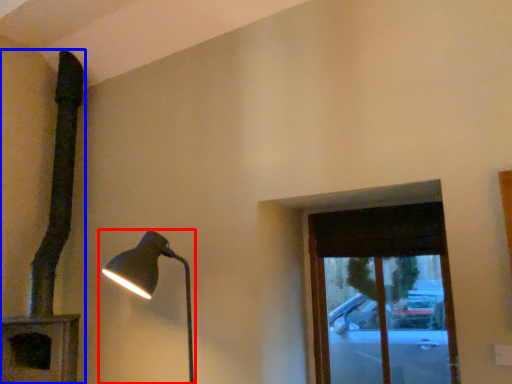
Question: Among these objects, which one is nearest to the camera, lamp (highlighted by a red box) or lamp (highlighted by a blue box)?

Choices:
 (A) lamp
 (B) lamp

Answer: (A)